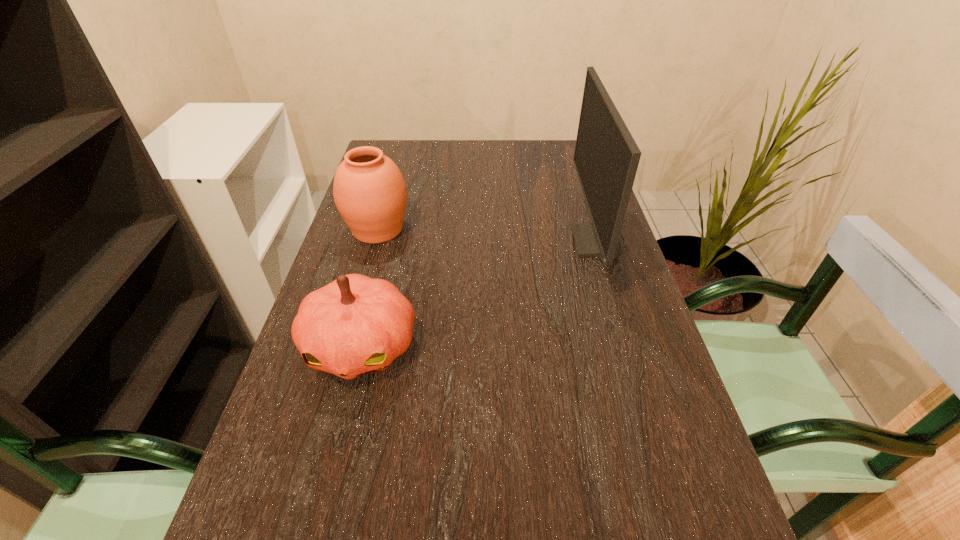
Where is `computer monitor`? The height and width of the screenshot is (540, 960). computer monitor is located at coordinates (606, 158).

You are a GUI agent. You are given a task and a screenshot of the screen. Output one action in this format:
    pyautogui.click(x=<x>, y=<y>)
    Task: Click on the rightmost object
    The height and width of the screenshot is (540, 960).
    Given the screenshot: What is the action you would take?
    pyautogui.click(x=606, y=158)

The image size is (960, 540). What are the coordinates of `urn` in the screenshot? It's located at (369, 190).

I want to click on the nearest object, so click(x=355, y=325).

Find the location of `vacant space located 0.280m on the front-facing side of the tallest object`. vacant space located 0.280m on the front-facing side of the tallest object is located at coordinates (468, 241).

Where is `blank space located on the front-facing side of the tallest object`? blank space located on the front-facing side of the tallest object is located at coordinates (543, 241).

Find the location of a particular element. Image resolution: width=960 pixels, height=540 pixels. free spot located on the front-facing side of the tallest object is located at coordinates (460, 241).

At what (x,y) coordinates should I click in order to perform the action: click on vacant space located on the back of the urn. Please return your answer as a coordinate pair (x, y). The height and width of the screenshot is (540, 960). Looking at the image, I should click on (387, 197).

This screenshot has width=960, height=540. Identify the location of blank space located 0.120m on the front-facing side of the pumpkin. (334, 456).

Locate an element on the screen. urn that is positioned at the left edge is located at coordinates (369, 190).